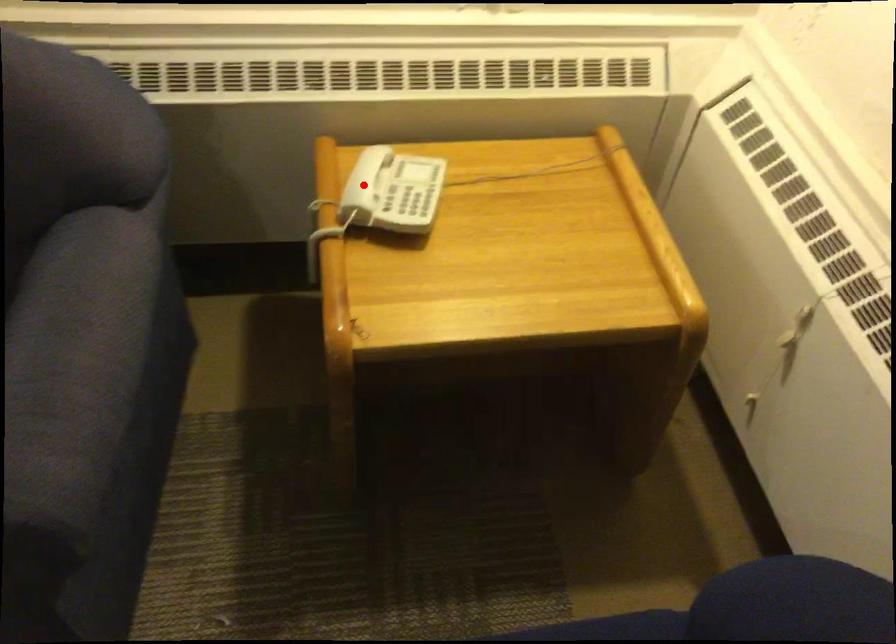
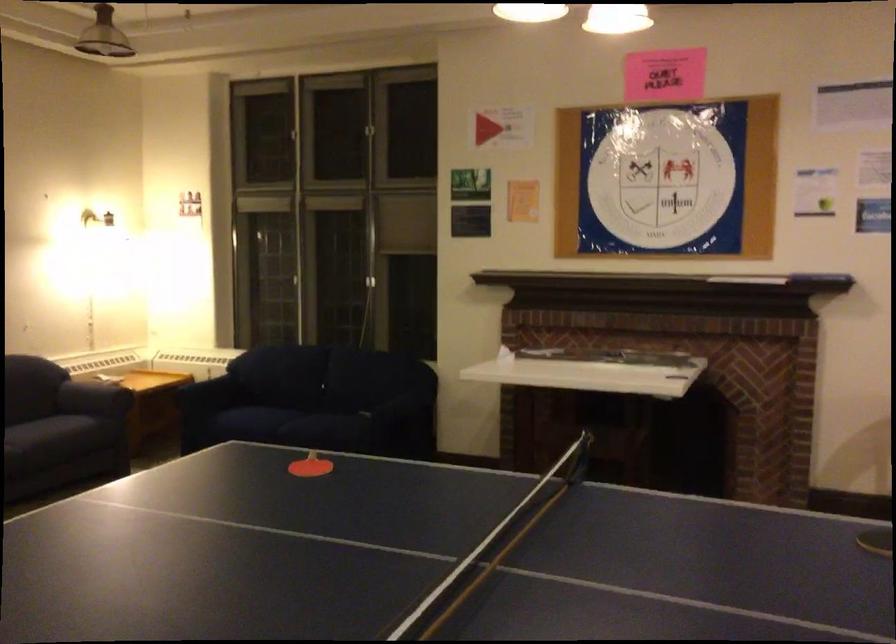
Question: I am providing you with two images of the same scene from different viewpoints. A red point is marked on the first image. At the location where the point appears in image 1, is it still visible in image 2?

Choices:
 (A) Yes
 (B) No

Answer: (B)